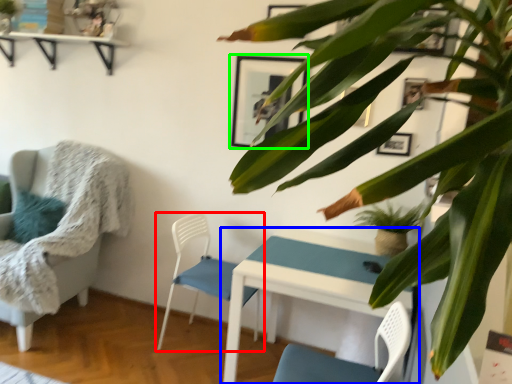
Question: Which is farther away from chair (highlighted by a red box)? table (highlighted by a blue box) or picture frame (highlighted by a green box)?

Choices:
 (A) table
 (B) picture frame

Answer: (B)